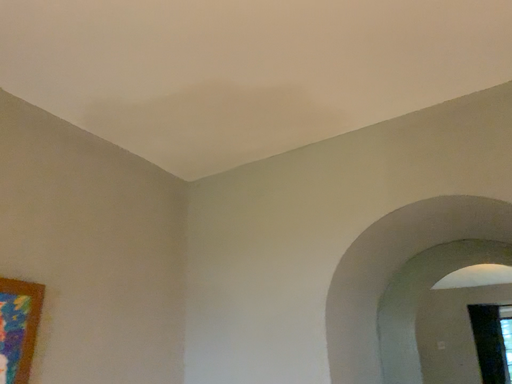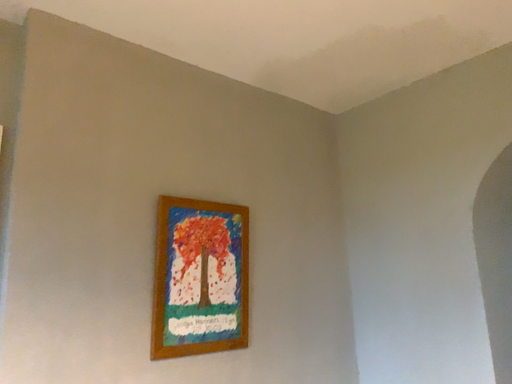
Question: Which way did the camera rotate in the video?

Choices:
 (A) rotated right
 (B) rotated left

Answer: (B)